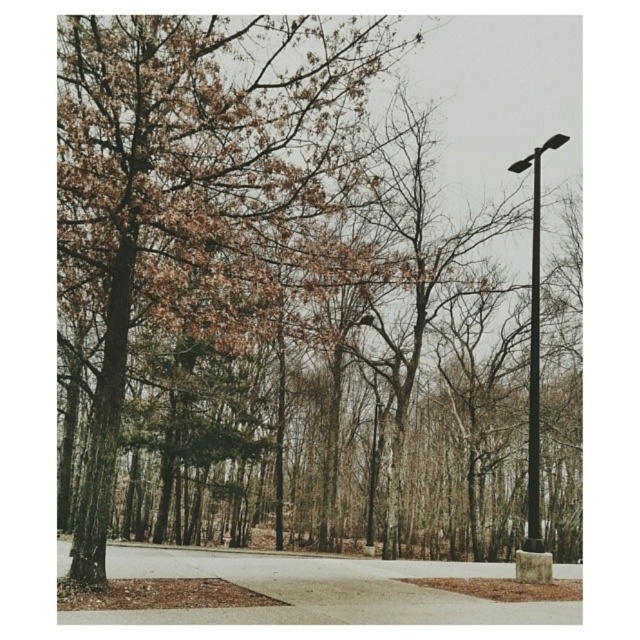
Image resolution: width=640 pixels, height=640 pixels. What do you see at coordinates (534, 346) in the screenshot?
I see `black metal street light at right` at bounding box center [534, 346].

Consider the image. Is black metal street light at right below smooth black pole at center?

No.

Is point (564, 134) closer to viewer compared to point (372, 429)?

Yes.

Locate an element on the screen. The image size is (640, 640). black metal street light at right is located at coordinates (534, 346).

Can you confirm if black metal pole at right is positioned to the right of smooth black pole at center?

Yes, black metal pole at right is to the right of smooth black pole at center.

Can you confirm if black metal pole at right is shorter than smooth black pole at center?

No.

Does point (532, 369) come in front of point (380, 442)?

That is True.

Locate an element on the screen. Image resolution: width=640 pixels, height=640 pixels. black metal pole at right is located at coordinates (532, 364).

Which of these two, brown wood tree at center or black metal street light at right, stands shorter?

Result: Standing shorter between the two is brown wood tree at center.

Between brown wood tree at center and black metal street light at right, which one appears on the right side from the viewer's perspective?

black metal street light at right

Which is behind, point (113, 403) or point (536, 260)?

The point (536, 260) is behind.

The height and width of the screenshot is (640, 640). I want to click on brown wood tree at center, so click(200, 179).